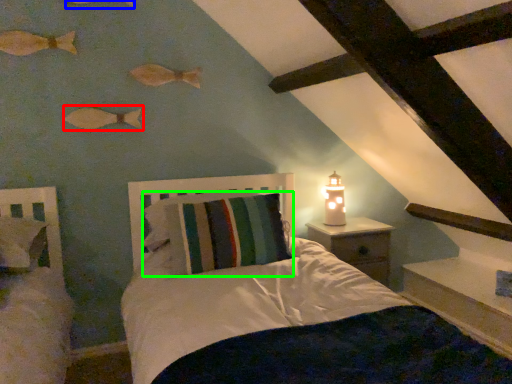
Question: Considering the real-world distances, which object is closest to fish (highlighted by a red box)? fish (highlighted by a blue box) or pillow (highlighted by a green box).

Choices:
 (A) fish
 (B) pillow

Answer: (A)